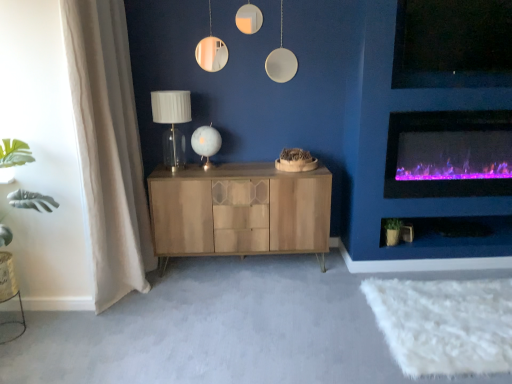
Question: Based on their positions, is purple electric fireplace at right located to the left or right of white glass table lamp at center, positioned as the 1th table lamp in right-to-left order?

Choices:
 (A) right
 (B) left

Answer: (A)

Question: Is purple electric fireplace at right taller or shorter than white glass table lamp at center, positioned as the 1th table lamp in right-to-left order?

Choices:
 (A) tall
 (B) short

Answer: (A)

Question: Which is nearer to the purple electric fireplace at right?

Choices:
 (A) matte white glass table lamp at center, placed as the 2th table lamp when sorted from right to left
 (B) white glass table lamp at center, positioned as the 1th table lamp in right-to-left order
 (C) beige fabric curtain at left
 (D) green matte plant at lower right
 (E) wooden cabinet at center

Answer: (D)

Question: Based on their relative distances, which object is nearer to the beige fabric curtain at left?

Choices:
 (A) matte white glass table lamp at center, marked as the 1th table lamp in a left-to-right arrangement
 (B) purple electric fireplace at right
 (C) green matte plant at lower right
 (D) white glass table lamp at center, positioned as the 1th table lamp in right-to-left order
 (E) wooden cabinet at center

Answer: (A)